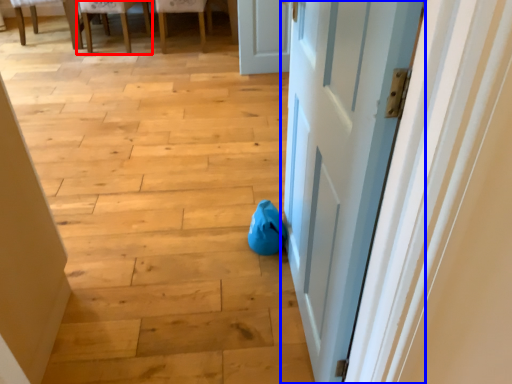
Question: Among these objects, which one is farthest to the camera, chair (highlighted by a red box) or door (highlighted by a blue box)?

Choices:
 (A) chair
 (B) door

Answer: (A)